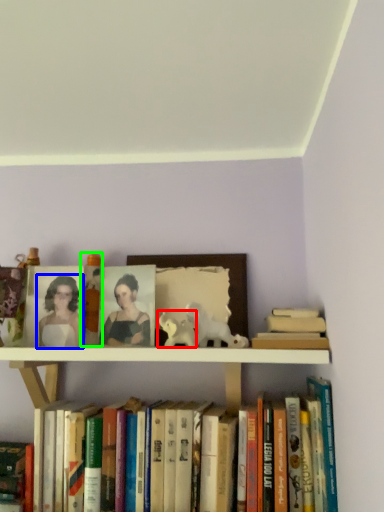
Question: Which object is positioned closest to animal (highlighted by a red box)? Select from woman (highlighted by a blue box) and toy (highlighted by a green box).

Choices:
 (A) woman
 (B) toy

Answer: (B)